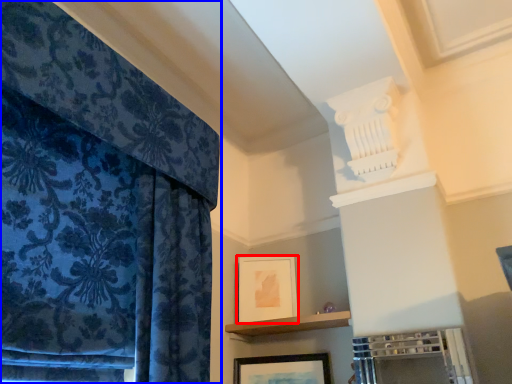
Question: Which object appears closest to the camera in this image, picture frame (highlighted by a red box) or curtain (highlighted by a blue box)?

Choices:
 (A) picture frame
 (B) curtain

Answer: (B)